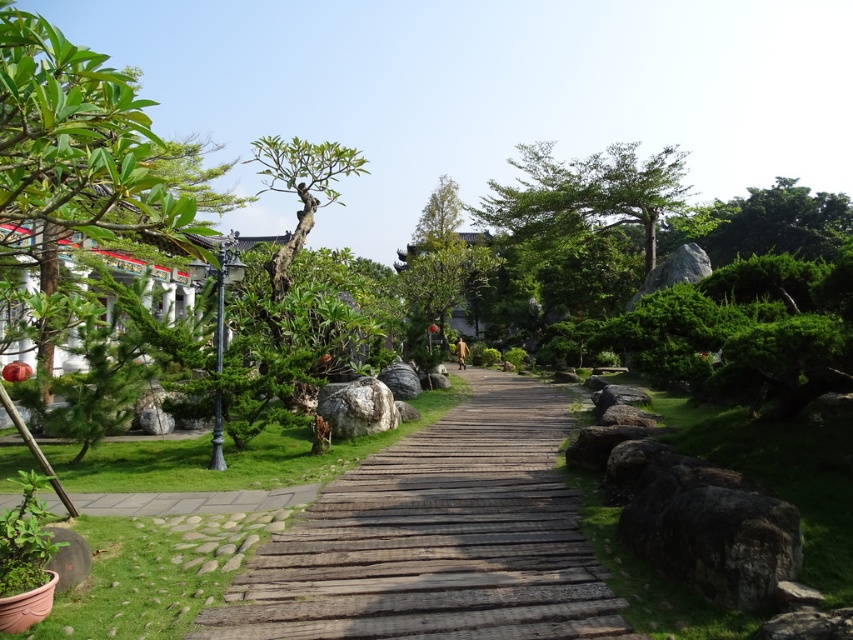
Question: Is green leafy tree at upper center positioned in front of gray rough stone at left?

Choices:
 (A) no
 (B) yes

Answer: (A)

Question: Considering the relative positions of gray rough rock at center and gray rough stone at left in the image provided, where is gray rough rock at center located with respect to gray rough stone at left?

Choices:
 (A) right
 (B) left

Answer: (A)

Question: Considering the real-world distances, which object is farthest from the gray polished stone at center?

Choices:
 (A) green leafy tree at upper center
 (B) weathered wood path at center

Answer: (A)

Question: Among these points, which one is nearest to the camera?

Choices:
 (A) (416, 394)
 (B) (270, 561)
 (C) (341, 435)

Answer: (B)

Question: Can you confirm if gray rough rock at lower right is positioned below gray polished stone at center?

Choices:
 (A) no
 (B) yes

Answer: (B)

Question: Considering the real-world distances, which object is farthest from the gray rough stone at left?

Choices:
 (A) weathered wood path at center
 (B) gray rough rock at lower right
 (C) green leafy tree at left

Answer: (B)